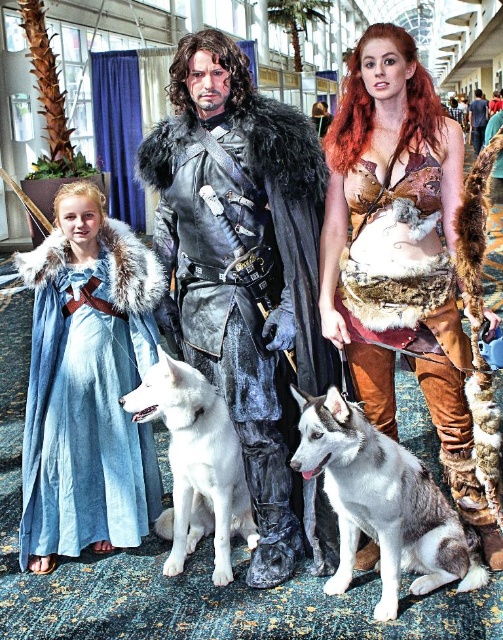
You are a photographer at the event and need to capture a photo that includes both the blue cotton dress at left and the shiny silver armor at center. Which object should you focus on first to ensure both are in sharp focus?

The blue cotton dress at left is closer to the viewer than the shiny silver armor at center. To ensure both are in sharp focus, you should focus on the shiny silver armor at center first, as focusing on the farther object allows the closer one to be within the depth of field.